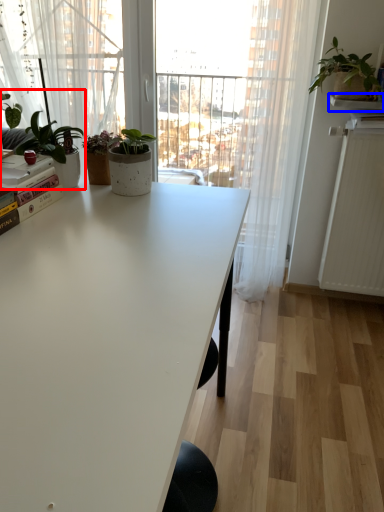
Question: Which of the following is the closest to the observer, houseplant (highlighted by a red box) or window sill (highlighted by a blue box)?

Choices:
 (A) houseplant
 (B) window sill

Answer: (A)